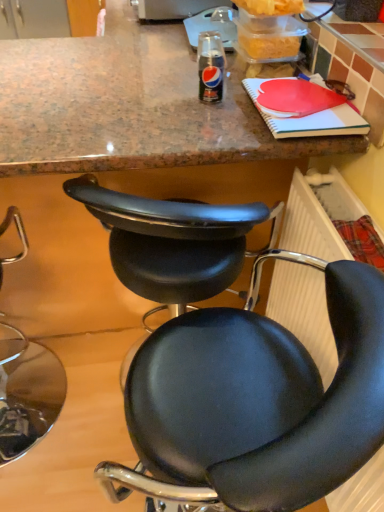
Question: From a real-world perspective, is black leather chair at center, positioned as the third chair in left-to-right order, on top of black leather chair at center, which appears as the second chair when viewed from the left?

Choices:
 (A) no
 (B) yes

Answer: (B)

Question: Is black leather chair at center, the first chair in the right-to-left sequence, thinner than black leather chair at center, which ranks as the second chair in right-to-left order?

Choices:
 (A) no
 (B) yes

Answer: (A)

Question: Does black leather chair at center, positioned as the third chair in left-to-right order, appear on the left side of black leather chair at center, which appears as the second chair when viewed from the left?

Choices:
 (A) no
 (B) yes

Answer: (A)

Question: Does black leather chair at center, the first chair in the right-to-left sequence, have a greater width compared to black leather chair at center, which appears as the second chair when viewed from the left?

Choices:
 (A) yes
 (B) no

Answer: (A)

Question: Considering the relative sizes of black leather chair at center, positioned as the third chair in left-to-right order, and black leather chair at center, which appears as the second chair when viewed from the left, in the image provided, is black leather chair at center, positioned as the third chair in left-to-right order, taller than black leather chair at center, which appears as the second chair when viewed from the left,?

Choices:
 (A) no
 (B) yes

Answer: (B)

Question: Considering the positions of black leather chair at lower left, arranged as the third chair when viewed from the right, and black leather chair at center, which ranks as the second chair in right-to-left order, in the image, is black leather chair at lower left, arranged as the third chair when viewed from the right, wider or thinner than black leather chair at center, which ranks as the second chair in right-to-left order,?

Choices:
 (A) wide
 (B) thin

Answer: (A)

Question: Would you say black leather chair at lower left, acting as the 1th chair starting from the left, is to the left or to the right of black leather chair at center, which appears as the second chair when viewed from the left, in the picture?

Choices:
 (A) left
 (B) right

Answer: (A)

Question: Is black leather chair at lower left, arranged as the third chair when viewed from the right, spatially inside black leather chair at center, which appears as the second chair when viewed from the left, or outside of it?

Choices:
 (A) outside
 (B) inside

Answer: (A)

Question: Is point (44, 392) closer or farther from the camera than point (137, 204)?

Choices:
 (A) closer
 (B) farther

Answer: (B)

Question: Does point (276, 204) appear closer or farther from the camera than point (299, 181)?

Choices:
 (A) closer
 (B) farther

Answer: (B)

Question: Based on their positions, is black leather chair at center, which appears as the second chair when viewed from the left, located to the left or right of plastic radiator at lower right?

Choices:
 (A) right
 (B) left

Answer: (B)

Question: From a real-world perspective, relative to plastic radiator at lower right, is black leather chair at center, which ranks as the second chair in right-to-left order, vertically above or below?

Choices:
 (A) below
 (B) above

Answer: (A)

Question: From their relative heights in the image, would you say black leather chair at center, which appears as the second chair when viewed from the left, is taller or shorter than plastic radiator at lower right?

Choices:
 (A) tall
 (B) short

Answer: (A)

Question: In terms of height, does black leather chair at center, positioned as the third chair in left-to-right order, look taller or shorter compared to black leather chair at lower left, arranged as the third chair when viewed from the right?

Choices:
 (A) tall
 (B) short

Answer: (A)

Question: In the image, is black leather chair at center, positioned as the third chair in left-to-right order, positioned in front of or behind black leather chair at lower left, acting as the 1th chair starting from the left?

Choices:
 (A) front
 (B) behind

Answer: (A)